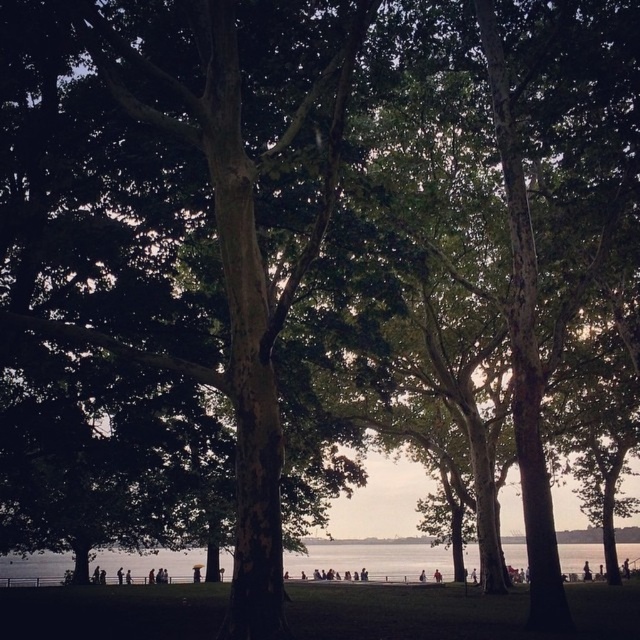
Between clear water at lower center and light brown wooden stick at center, which one has more height?

Standing taller between the two is clear water at lower center.

From the picture: Who is more distant from viewer, (285, 566) or (436, 568)?

The point (436, 568) is more distant.

Where is `clear water at lower center`? The width and height of the screenshot is (640, 640). clear water at lower center is located at coordinates (372, 560).